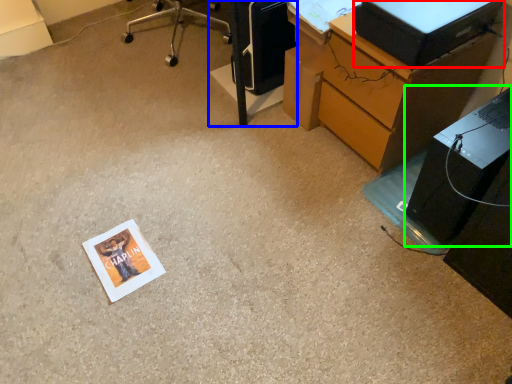
Question: Which object is the closest to the desktop computer (highlighted by a red box)? Choose among these: furniture (highlighted by a blue box) or computer tower (highlighted by a green box).

Choices:
 (A) furniture
 (B) computer tower

Answer: (B)